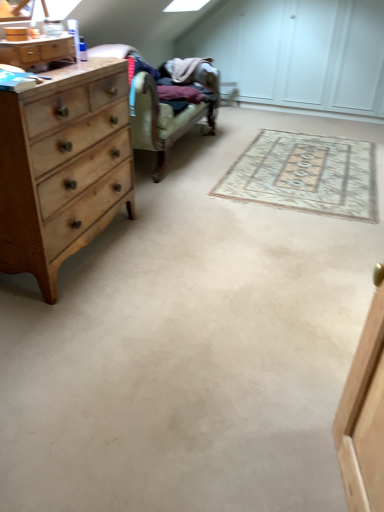
Question: Is point (51, 129) positioned closer to the camera than point (39, 47)?

Choices:
 (A) closer
 (B) farther

Answer: (A)

Question: From the image's perspective, is light brown wood chest of drawers at left positioned above or below wooden dresser at left?

Choices:
 (A) below
 (B) above

Answer: (A)

Question: Which is nearer to the wooden dresser at left?

Choices:
 (A) light brown wood chest of drawers at left
 (B) beige woven rug at center

Answer: (A)

Question: Which object is the farthest from the beige woven rug at center?

Choices:
 (A) light brown wood chest of drawers at left
 (B) wooden dresser at left

Answer: (B)